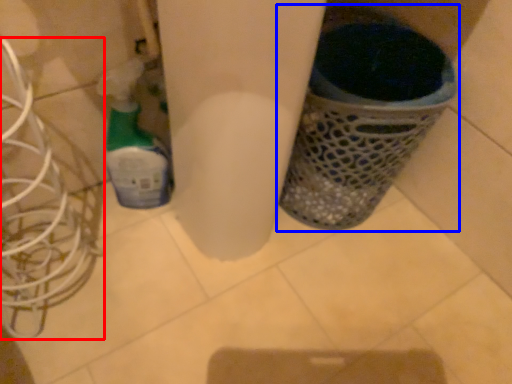
Question: Which of the following is the farthest to the observer, wire (highlighted by a red box) or waste container (highlighted by a blue box)?

Choices:
 (A) wire
 (B) waste container

Answer: (B)